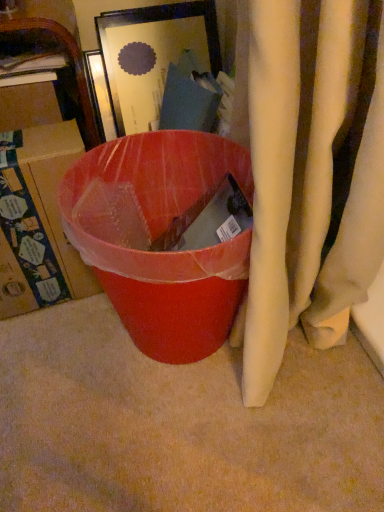
Describe the element at coordinates (158, 234) in the screenshot. Image resolution: width=384 pixels, height=512 pixels. I see `matte plastic trash can at center` at that location.

Where is `matte plastic trash can at center`? matte plastic trash can at center is located at coordinates (158, 234).

Where is `matte cardboard box at left`? The height and width of the screenshot is (512, 384). matte cardboard box at left is located at coordinates (38, 221).

The height and width of the screenshot is (512, 384). Describe the element at coordinates (38, 221) in the screenshot. I see `matte cardboard box at left` at that location.

Measure the distance between point (76, 143) and camera.

The depth of point (76, 143) is 65.00 centimeters.

Locate an element on the screen. matte plastic trash can at center is located at coordinates (158, 234).

Which is more to the right, matte plastic trash can at center or matte cardboard box at left?

Positioned to the right is matte plastic trash can at center.

Who is more distant, matte plastic trash can at center or matte cardboard box at left?

matte cardboard box at left is more distant.

Considering the positions of points (133, 330) and (41, 211), is point (133, 330) closer to camera compared to point (41, 211)?

No, (133, 330) is behind (41, 211).

From the image's perspective, is matte plastic trash can at center located beneath matte cardboard box at left?

Yes, from the image's perspective, matte plastic trash can at center is below matte cardboard box at left.

From a real-world perspective, which object stands above the other?

matte cardboard box at left is physically above.

Between matte plastic trash can at center and matte cardboard box at left, which one has larger width?

With larger width is matte plastic trash can at center.

From the picture: Considering the relative sizes of matte plastic trash can at center and matte cardboard box at left in the image provided, is matte plastic trash can at center shorter than matte cardboard box at left?

No, matte plastic trash can at center is not shorter than matte cardboard box at left.

Which of these two, matte plastic trash can at center or matte cardboard box at left, is bigger?

Answer: Bigger between the two is matte plastic trash can at center.

Can matte cardboard box at left be found inside matte plastic trash can at center?

No, matte cardboard box at left is located outside of matte plastic trash can at center.

Are matte plastic trash can at center and matte cardboard box at left far apart?

matte plastic trash can at center is near matte cardboard box at left, not far away.

Is matte plastic trash can at center looking in the opposite direction of matte cardboard box at left?

matte plastic trash can at center does not have its back to matte cardboard box at left.

How many degrees apart are the facing directions of matte plastic trash can at center and matte cardboard box at left?

matte plastic trash can at center and matte cardboard box at left are facing 98 degrees away from each other.

The height and width of the screenshot is (512, 384). What are the coordinates of `trash bin/can to the right of matte cardboard box at left` in the screenshot? It's located at (158, 234).

Is matte cardboard box at left to the left of matte plastic trash can at center from the viewer's perspective?

Yes, matte cardboard box at left is to the left of matte plastic trash can at center.

Does matte cardboard box at left lie behind matte plastic trash can at center?

Yes.

Which point is more forward, (47, 296) or (121, 281)?

The point (121, 281) is in front.

From the image's perspective, which one is positioned higher, matte cardboard box at left or matte plastic trash can at center?

matte cardboard box at left appears higher in the image.

From a real-world perspective, is matte cardboard box at left physically located above or below matte plastic trash can at center?

From a real-world perspective, matte cardboard box at left is physically above matte plastic trash can at center.

Considering the sizes of objects matte cardboard box at left and matte plastic trash can at center in the image provided, who is thinner, matte cardboard box at left or matte plastic trash can at center?

matte cardboard box at left is thinner.

Considering the relative sizes of matte cardboard box at left and matte plastic trash can at center in the image provided, is matte cardboard box at left taller than matte plastic trash can at center?

In fact, matte cardboard box at left may be shorter than matte plastic trash can at center.

Can you confirm if matte cardboard box at left is bigger than matte plastic trash can at center?

No.

Can we say matte cardboard box at left lies outside matte plastic trash can at center?

Yes, matte cardboard box at left is located beyond the bounds of matte plastic trash can at center.

Is matte cardboard box at left with matte plastic trash can at center?

There is a gap between matte cardboard box at left and matte plastic trash can at center.

Could you tell me if matte cardboard box at left is turned towards matte plastic trash can at center?

No.

You are a GUI agent. You are given a task and a screenshot of the screen. Output one action in this format:
    pyautogui.click(x=<x>, y=<y>)
    Task: Click on the trash bin/can beneath the matte cardboard box at left (from a real-world perspective)
    
    Given the screenshot: What is the action you would take?
    pyautogui.click(x=158, y=234)

Where is `box that is above the matte plastic trash can at center (from a real-world perspective)`? Image resolution: width=384 pixels, height=512 pixels. box that is above the matte plastic trash can at center (from a real-world perspective) is located at coordinates (38, 221).

Locate an element on the screen. The height and width of the screenshot is (512, 384). trash bin/can beneath the matte cardboard box at left (from a real-world perspective) is located at coordinates (158, 234).